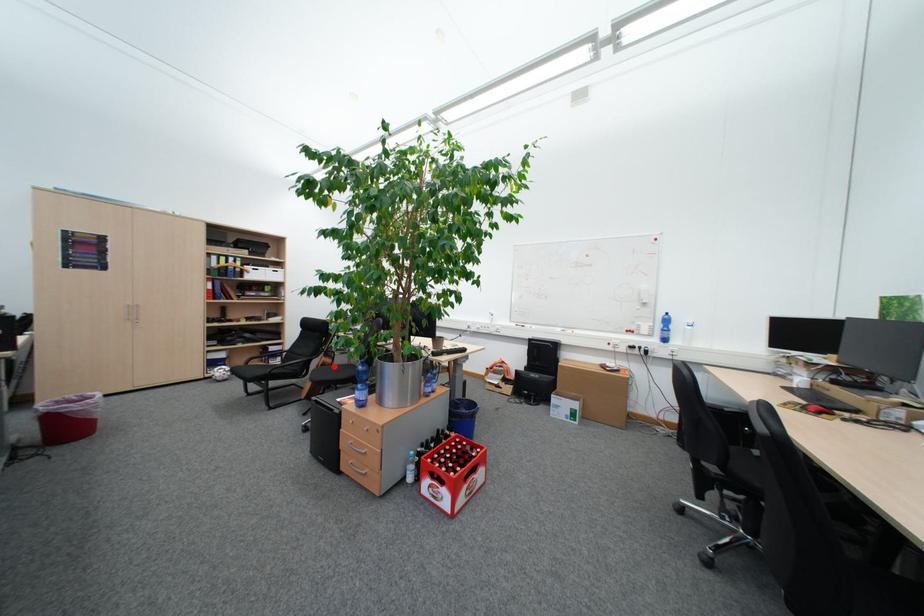
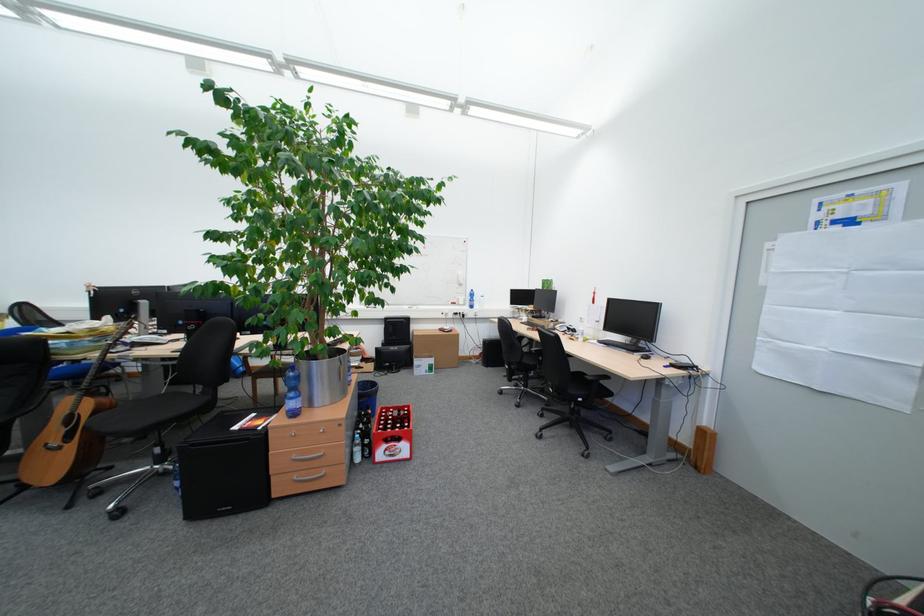
The point at the highlighted location is marked in the first image. Where is the corresponding point in the second image?

(110, 411)